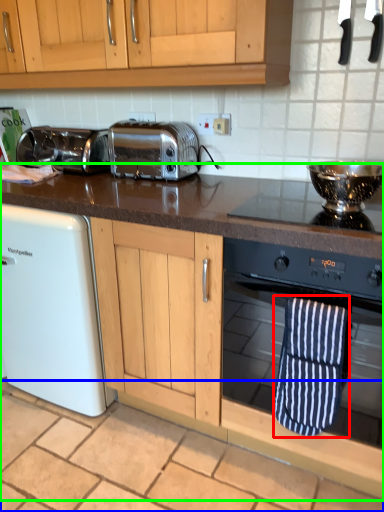
Question: Based on their relative distances, which object is nearer to beach towel (highlighted by a red box)? Choose from tile (highlighted by a blue box) and countertop (highlighted by a green box).

Choices:
 (A) tile
 (B) countertop

Answer: (B)